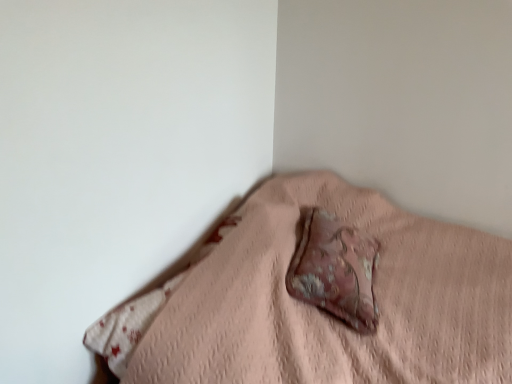
The width and height of the screenshot is (512, 384). Find the location of `distressed pink fabric pillow at center`. distressed pink fabric pillow at center is located at coordinates (335, 270).

What do you see at coordinates (335, 270) in the screenshot?
I see `distressed pink fabric pillow at center` at bounding box center [335, 270].

Measure the distance between pink fabric pillow at center and camera.

pink fabric pillow at center is 3.42 feet away from camera.

The width and height of the screenshot is (512, 384). What do you see at coordinates (318, 308) in the screenshot? I see `pink fabric pillow at center` at bounding box center [318, 308].

Locate an element on the screen. pink fabric pillow at center is located at coordinates (318, 308).

At what (x,y) coordinates should I click in order to perform the action: click on distressed pink fabric pillow at center. Please return your answer as a coordinate pair (x, y). The image size is (512, 384). Looking at the image, I should click on (335, 270).

Considering the positions of objects distressed pink fabric pillow at center and pink fabric pillow at center in the image provided, who is more to the right, distressed pink fabric pillow at center or pink fabric pillow at center?

Positioned to the right is pink fabric pillow at center.

In the image, is distressed pink fabric pillow at center positioned in front of or behind pink fabric pillow at center?

Visually, distressed pink fabric pillow at center is located behind pink fabric pillow at center.

Which point is more forward, (338,237) or (298,222)?

The point (338,237) is closer to the camera.

From the image's perspective, is distressed pink fabric pillow at center positioned above or below pink fabric pillow at center?

Based on their image positions, distressed pink fabric pillow at center is located above pink fabric pillow at center.

From a real-world perspective, does distressed pink fabric pillow at center sit lower than pink fabric pillow at center?

No.

Is distressed pink fabric pillow at center wider than pink fabric pillow at center?

Incorrect, the width of distressed pink fabric pillow at center does not surpass that of pink fabric pillow at center.

Does distressed pink fabric pillow at center have a greater height compared to pink fabric pillow at center?

No.

Is distressed pink fabric pillow at center bigger than pink fabric pillow at center?

No.

Could pink fabric pillow at center be considered to be inside distressed pink fabric pillow at center?

No, pink fabric pillow at center is not surrounded by distressed pink fabric pillow at center.

Is distressed pink fabric pillow at center next to pink fabric pillow at center?

No, distressed pink fabric pillow at center is not in contact with pink fabric pillow at center.

Is distressed pink fabric pillow at center oriented away from pink fabric pillow at center?

Yes, distressed pink fabric pillow at center is facing away from pink fabric pillow at center.

How much distance is there between distressed pink fabric pillow at center and pink fabric pillow at center?

The distance of distressed pink fabric pillow at center from pink fabric pillow at center is 5.76 inches.

Identify the location of throw pillow behind the pink fabric pillow at center. This screenshot has width=512, height=384. (335, 270).

Can you confirm if pink fabric pillow at center is positioned to the left of distressed pink fabric pillow at center?

Incorrect, pink fabric pillow at center is not on the left side of distressed pink fabric pillow at center.

Considering their positions, is pink fabric pillow at center located in front of or behind distressed pink fabric pillow at center?

In the image, pink fabric pillow at center appears in front of distressed pink fabric pillow at center.

Is point (179, 316) positioned after point (288, 290)?

No, it is not.

From the image's perspective, is pink fabric pillow at center above or below distressed pink fabric pillow at center?

→ pink fabric pillow at center is situated lower than distressed pink fabric pillow at center in the image.

From a real-world perspective, between pink fabric pillow at center and distressed pink fabric pillow at center, who is vertically higher?

In real-world perspective, distressed pink fabric pillow at center is above.

Considering the relative sizes of pink fabric pillow at center and distressed pink fabric pillow at center in the image provided, is pink fabric pillow at center wider than distressed pink fabric pillow at center?

Yes.

Who is shorter, pink fabric pillow at center or distressed pink fabric pillow at center?

distressed pink fabric pillow at center is shorter.

Considering the relative sizes of pink fabric pillow at center and distressed pink fabric pillow at center in the image provided, is pink fabric pillow at center smaller than distressed pink fabric pillow at center?

Incorrect, pink fabric pillow at center is not smaller in size than distressed pink fabric pillow at center.

Is pink fabric pillow at center not inside distressed pink fabric pillow at center?

Yes.

Is pink fabric pillow at center next to distressed pink fabric pillow at center and touching it?

They are not placed beside each other.

Is pink fabric pillow at center facing away from distressed pink fabric pillow at center?

Absolutely, pink fabric pillow at center is directed away from distressed pink fabric pillow at center.

In the image, there is a distressed pink fabric pillow at center. At what (x,y) coordinates should I click in order to perform the action: click on furniture below it (from a real-world perspective). Please return your answer as a coordinate pair (x, y). The image size is (512, 384). Looking at the image, I should click on (318, 308).

At what (x,y) coordinates should I click in order to perform the action: click on furniture that appears on the right of distressed pink fabric pillow at center. Please return your answer as a coordinate pair (x, y). Image resolution: width=512 pixels, height=384 pixels. Looking at the image, I should click on (318, 308).

Locate an element on the screen. throw pillow above the pink fabric pillow at center (from the image's perspective) is located at coordinates tap(335, 270).